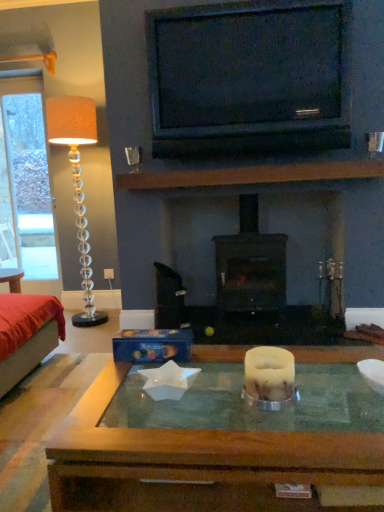
Question: Considering the relative positions of black glossy tv at upper center and white wax candle at center in the image provided, is black glossy tv at upper center to the left of white wax candle at center from the viewer's perspective?

Choices:
 (A) no
 (B) yes

Answer: (A)

Question: Does black glossy tv at upper center lie behind white wax candle at center?

Choices:
 (A) yes
 (B) no

Answer: (A)

Question: Considering the relative sizes of black glossy tv at upper center and white wax candle at center in the image provided, is black glossy tv at upper center taller than white wax candle at center?

Choices:
 (A) yes
 (B) no

Answer: (A)

Question: Is black glossy tv at upper center smaller than white wax candle at center?

Choices:
 (A) no
 (B) yes

Answer: (A)

Question: Considering the relative sizes of black glossy tv at upper center and white wax candle at center in the image provided, is black glossy tv at upper center shorter than white wax candle at center?

Choices:
 (A) no
 (B) yes

Answer: (A)

Question: Is metallic silver coffee cup at upper left in front of or behind velvet red bed at left in the image?

Choices:
 (A) behind
 (B) front

Answer: (A)

Question: Is point (135, 162) positioned closer to the camera than point (9, 293)?

Choices:
 (A) farther
 (B) closer

Answer: (A)

Question: Is metallic silver coffee cup at upper left bigger or smaller than velvet red bed at left?

Choices:
 (A) big
 (B) small

Answer: (B)

Question: Would you say metallic silver coffee cup at upper left is inside or outside velvet red bed at left?

Choices:
 (A) inside
 (B) outside

Answer: (B)

Question: Is translucent glass floor lamp at left bigger or smaller than black matte wood burning stove at center?

Choices:
 (A) big
 (B) small

Answer: (B)

Question: Visually, is translucent glass floor lamp at left positioned to the left or to the right of black matte wood burning stove at center?

Choices:
 (A) left
 (B) right

Answer: (A)

Question: Relative to black matte wood burning stove at center, is translucent glass floor lamp at left in front or behind?

Choices:
 (A) behind
 (B) front

Answer: (A)

Question: From the image's perspective, relative to black matte wood burning stove at center, is translucent glass floor lamp at left above or below?

Choices:
 (A) below
 (B) above

Answer: (B)

Question: In the image, is black matte wood burning stove at center on the left side or the right side of translucent glass floor lamp at left?

Choices:
 (A) left
 (B) right

Answer: (B)

Question: In terms of size, does black matte wood burning stove at center appear bigger or smaller than translucent glass floor lamp at left?

Choices:
 (A) big
 (B) small

Answer: (A)